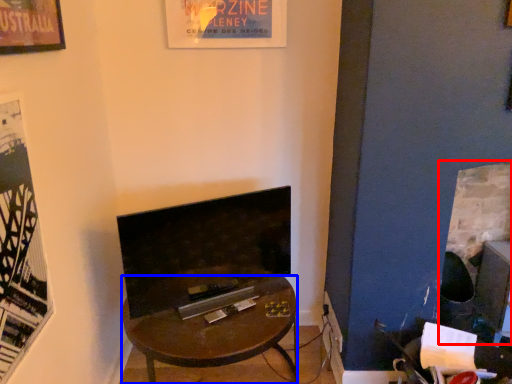
Question: Which object is closer to the camera taking this photo, fireplace (highlighted by a red box) or desk (highlighted by a blue box)?

Choices:
 (A) fireplace
 (B) desk

Answer: (B)